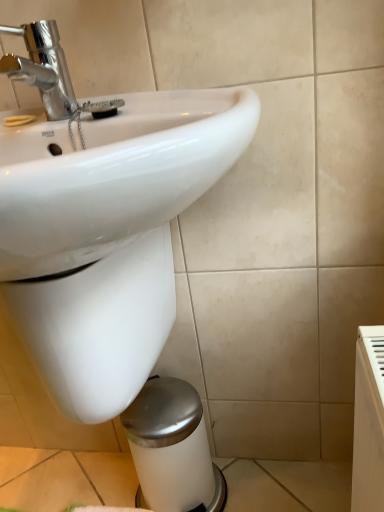
Find the location of `white glossy sink at upper left`. white glossy sink at upper left is located at coordinates (103, 221).

The height and width of the screenshot is (512, 384). What do you see at coordinates (103, 221) in the screenshot?
I see `white glossy sink at upper left` at bounding box center [103, 221].

You are a GUI agent. You are given a task and a screenshot of the screen. Output one action in this format:
    pyautogui.click(x=<x>, y=<y>)
    Task: Click on the white glossy sink at upper left
    Image resolution: width=384 pixels, height=512 pixels.
    Given the screenshot: What is the action you would take?
    pyautogui.click(x=103, y=221)